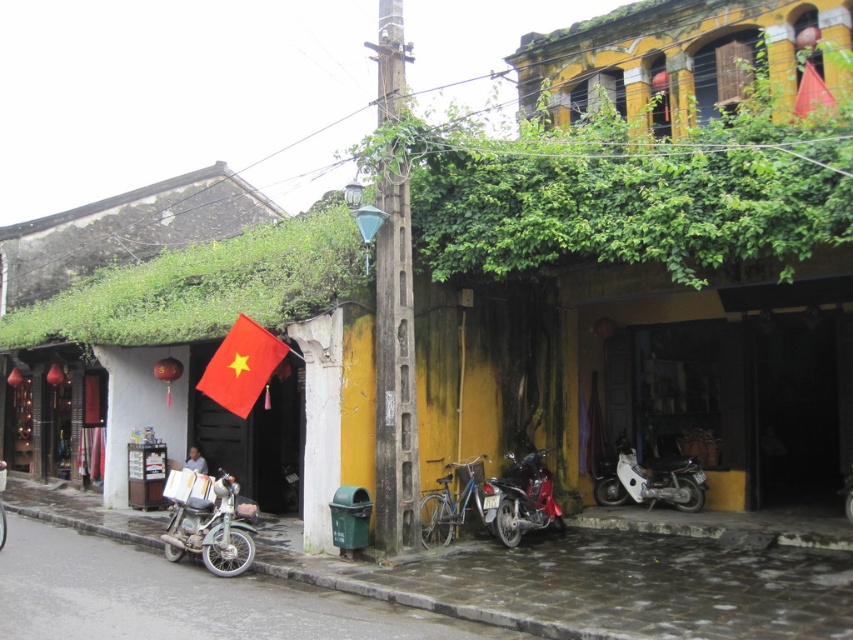
You are a delivery rider on a white matte motorcycle at lower center. You need to park your motorcycle under a shaded area. Is there a green leafy roof at upper left that can provide shade for your motorcycle?

Yes, the green leafy roof at upper left is positioned over the white matte motorcycle at lower center, so it can provide shade for the motorcycle.

You are a tourist standing on the street and want to take a photo of the red matte flag at center. However, there are green leafy vines at upper center in the way. Can you see the flag clearly through the vines?

The green leafy vines at upper center are closer to the viewer than the red matte flag at center, so they block the view of the flag. You cannot see the flag clearly through the vines.